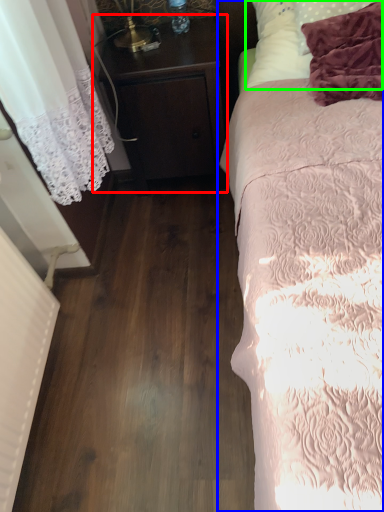
Question: Which object is positioned farthest from nightstand (highlighted by a red box)? Select from bed (highlighted by a blue box) and pillow (highlighted by a green box).

Choices:
 (A) bed
 (B) pillow

Answer: (A)